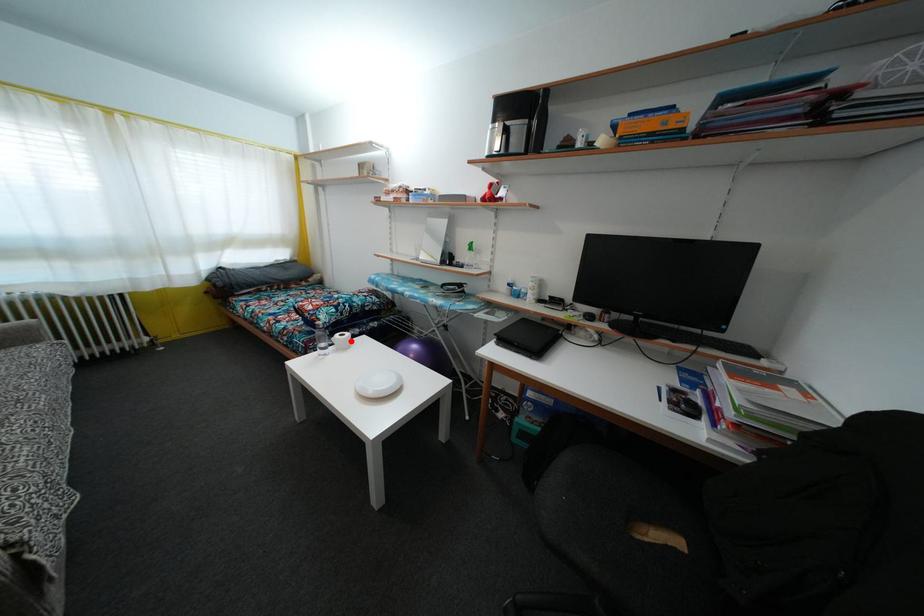
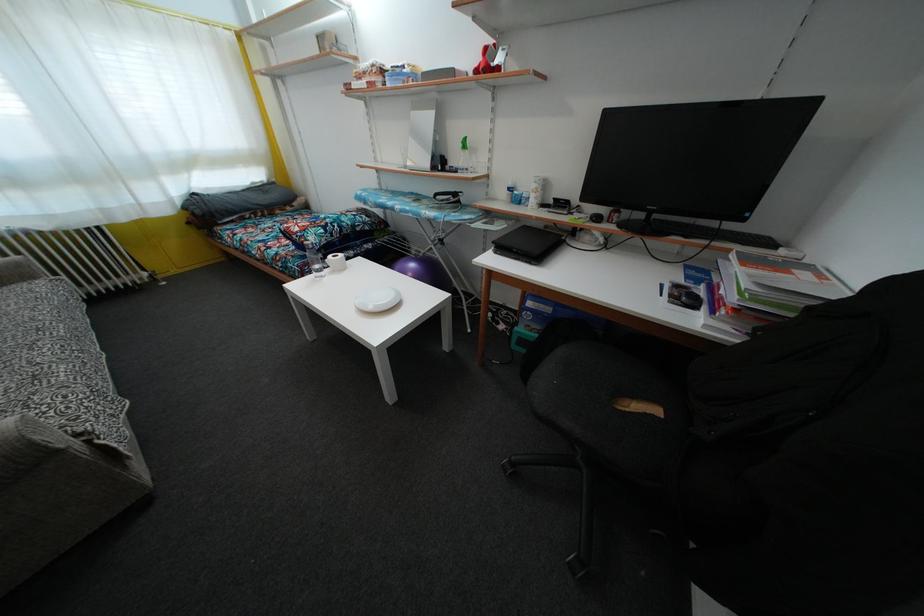
Locate, in the second image, the point that corresponds to the highlighted location in the first image.

(345, 262)